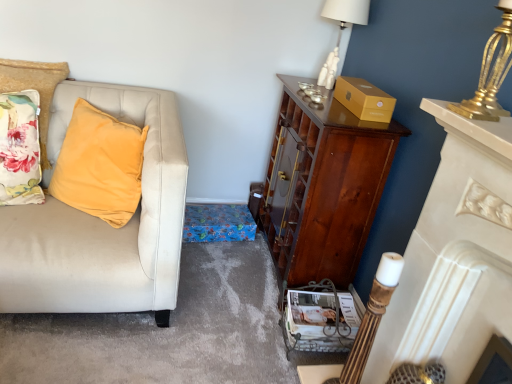
Question: Does gold metallic lamp at upper right, which is the first lamp in bottom-to-top order, have a greater width compared to shiny brown cabinet at right?

Choices:
 (A) no
 (B) yes

Answer: (A)

Question: Is gold metallic lamp at upper right, the second lamp from the back, in contact with shiny brown cabinet at right?

Choices:
 (A) yes
 (B) no

Answer: (B)

Question: From the image's perspective, is gold metallic lamp at upper right, which is counted as the 1th lamp, starting from the right, beneath shiny brown cabinet at right?

Choices:
 (A) no
 (B) yes

Answer: (A)

Question: Would you say shiny brown cabinet at right is part of gold metallic lamp at upper right, which appears as the 2th lamp when viewed from the top,'s contents?

Choices:
 (A) no
 (B) yes

Answer: (A)

Question: From the image's perspective, is gold metallic lamp at upper right, which is counted as the 1th lamp, starting from the right, over shiny brown cabinet at right?

Choices:
 (A) yes
 (B) no

Answer: (A)

Question: Is gold metallic lamp at upper right, which is counted as the 1th lamp, starting from the front, not within shiny brown cabinet at right?

Choices:
 (A) yes
 (B) no

Answer: (A)

Question: Can you confirm if velvet yellow pillow at left is shorter than matte white magazine at lower center?

Choices:
 (A) yes
 (B) no

Answer: (B)

Question: Are velvet yellow pillow at left and matte white magazine at lower center located far from each other?

Choices:
 (A) no
 (B) yes

Answer: (A)

Question: Does velvet yellow pillow at left turn towards matte white magazine at lower center?

Choices:
 (A) yes
 (B) no

Answer: (B)

Question: Would you say matte white magazine at lower center is part of velvet yellow pillow at left's contents?

Choices:
 (A) yes
 (B) no

Answer: (B)

Question: From the image's perspective, is velvet yellow pillow at left under matte white magazine at lower center?

Choices:
 (A) yes
 (B) no

Answer: (B)

Question: From the image's perspective, would you say velvet yellow pillow at left is positioned over matte white magazine at lower center?

Choices:
 (A) no
 (B) yes

Answer: (B)

Question: From a real-world perspective, is gold metallic lamp at upper right, which is counted as the 1th lamp, starting from the right, beneath floral fabric pillow at left?

Choices:
 (A) no
 (B) yes

Answer: (A)